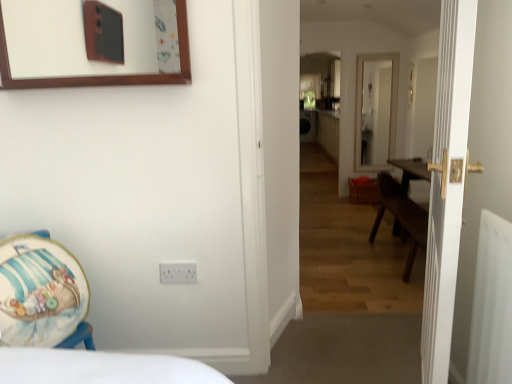
The height and width of the screenshot is (384, 512). Find the location of `free point to the left of wooden floor at center`. free point to the left of wooden floor at center is located at coordinates (303, 364).